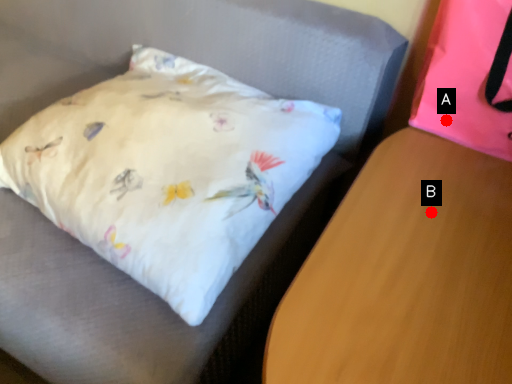
Question: Two points are circled on the image, labeled by A and B beside each circle. Which point appears farthest from the camera in this image?

Choices:
 (A) A is further
 (B) B is further

Answer: (A)